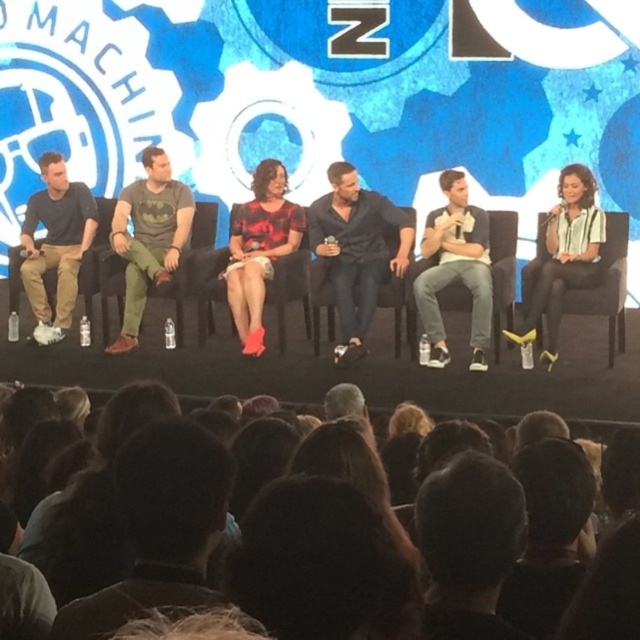
You are standing in the audience looking at the stage. A spotlight is placed at point (x=467, y=467). If the spotlight is 9.50 feet away from you, can you estimate how far the spotlight is from the first row of the audience?

The spotlight at point (x=467, y=467) is 9.50 feet away from you, so it is also 9.50 feet away from the first row of the audience if they are at the same position as you.

You are an event photographer trying to capture a closeup of the two points marked in the scene. Which point, point (480, 490) or point (179, 397), is closer to your camera lens?

Point (480, 490) is closer to the viewer than point (179, 397), so the photographer should focus on point (480, 490) for the closeup.